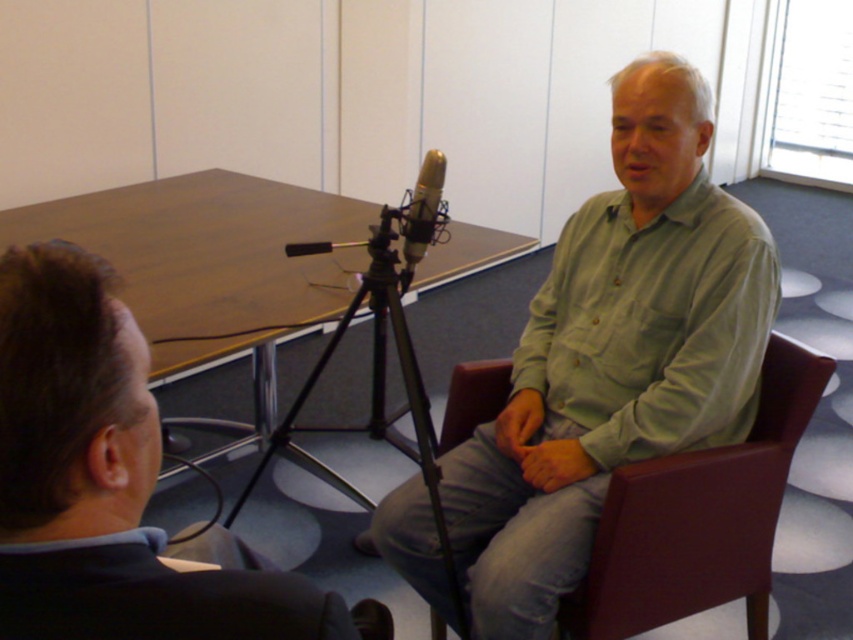
How much distance is there between green matte shirt at center and silver metallic microphone at center?

They are 20.83 inches apart.

Is green matte shirt at center taller than silver metallic microphone at center?

Yes.

Locate an element on the screen. This screenshot has height=640, width=853. green matte shirt at center is located at coordinates (614, 355).

Measure the distance between wooden at center and silver metallic microphone at center.

wooden at center and silver metallic microphone at center are 28.07 inches apart from each other.

Who is more forward, (161, 262) or (403, 230)?

Point (403, 230) is more forward.

Which is behind, point (73, 211) or point (436, 189)?

The point (73, 211) is behind.

Find the location of a particular element. This screenshot has width=853, height=640. wooden at center is located at coordinates (210, 248).

How much distance is there between black metal tripod at center and silver metallic microphone at center?

They are 13.95 inches apart.

What are the coordinates of `black metal tripod at center` in the screenshot? It's located at (375, 387).

The height and width of the screenshot is (640, 853). Find the location of `black metal tripod at center`. black metal tripod at center is located at coordinates (375, 387).